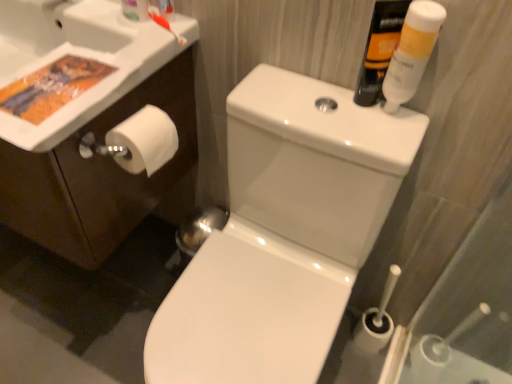
Question: Is translucent plastic mouthwash at upper right, the second mouthwash when ordered from right to left, positioned beyond the bounds of white glossy sink at upper left?

Choices:
 (A) yes
 (B) no

Answer: (A)

Question: Is white glossy sink at upper left at the back of translucent plastic mouthwash at upper right, the first mouthwash viewed from the left?

Choices:
 (A) no
 (B) yes

Answer: (A)

Question: From the image's perspective, is translucent plastic mouthwash at upper right, the first mouthwash viewed from the left, on white glossy sink at upper left?

Choices:
 (A) no
 (B) yes

Answer: (A)

Question: Is translucent plastic mouthwash at upper right, the first mouthwash viewed from the left, taller than white glossy sink at upper left?

Choices:
 (A) yes
 (B) no

Answer: (A)

Question: Considering the relative sizes of translucent plastic mouthwash at upper right, the second mouthwash when ordered from right to left, and white glossy sink at upper left in the image provided, is translucent plastic mouthwash at upper right, the second mouthwash when ordered from right to left, smaller than white glossy sink at upper left?

Choices:
 (A) yes
 (B) no

Answer: (A)

Question: From a real-world perspective, is translucent plastic mouthwash at upper right, the second mouthwash when ordered from right to left, below white glossy sink at upper left?

Choices:
 (A) yes
 (B) no

Answer: (B)

Question: Is orange plastic toothbrush at upper left directly adjacent to translucent plastic toothbrush at upper left?

Choices:
 (A) yes
 (B) no

Answer: (A)

Question: Is the depth of orange plastic toothbrush at upper left less than that of translucent plastic toothbrush at upper left?

Choices:
 (A) no
 (B) yes

Answer: (A)

Question: Can you confirm if orange plastic toothbrush at upper left is smaller than translucent plastic toothbrush at upper left?

Choices:
 (A) no
 (B) yes

Answer: (B)

Question: Is orange plastic toothbrush at upper left at the left side of translucent plastic toothbrush at upper left?

Choices:
 (A) yes
 (B) no

Answer: (B)

Question: Considering the relative sizes of orange plastic toothbrush at upper left and translucent plastic toothbrush at upper left in the image provided, is orange plastic toothbrush at upper left bigger than translucent plastic toothbrush at upper left?

Choices:
 (A) yes
 (B) no

Answer: (B)

Question: Is orange plastic toothbrush at upper left shorter than translucent plastic toothbrush at upper left?

Choices:
 (A) yes
 (B) no

Answer: (A)

Question: Is white matte toilet paper at left a part of white glossy sink at upper left?

Choices:
 (A) no
 (B) yes

Answer: (A)